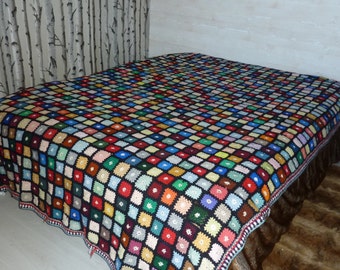
This screenshot has height=270, width=340. Find the location of `bed spread`. bed spread is located at coordinates (168, 144).